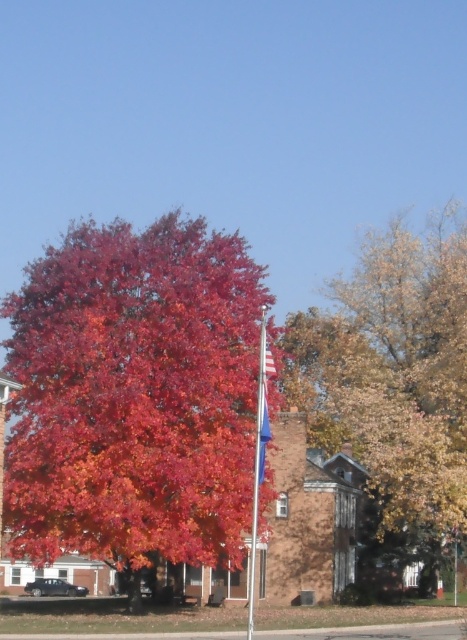
Is shiny red leaves at center closer to the viewer compared to golden-brown textured tree at center?

Yes, shiny red leaves at center is in front of golden-brown textured tree at center.

Does shiny red leaves at center appear under golden-brown textured tree at center?

Yes.

Which is in front, point (216, 307) or point (362, 371)?

Positioned in front is point (216, 307).

What are the coordinates of `shiny red leaves at center` in the screenshot? It's located at (134, 396).